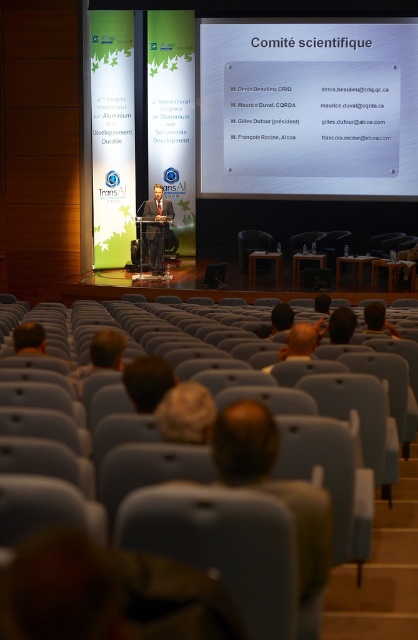
You are an attendee sitting at the back of the auditorium. You notice the white glossy projector screen at upper center and the light brown hair at lower center. How far apart are these two objects from your current position?

The white glossy projector screen at upper center is 43.70 feet away from the light brown hair at lower center, so from your position at the back, the distance between them remains 43.70 feet.

You are a photographer positioned at the camera location. You need to capture a clear image of the white glossy projector screen at upper center. Considering the distance, will you need a telephoto lens to focus on the screen from your current position?

Yes, since the white glossy projector screen at upper center is 17.38 meters away from the camera, a telephoto lens would be necessary to focus on the screen from this distance.

You are attending a formal conference about aluminum and sustainable development in a large auditorium. You notice a speaker at the podium and a point marked at coordinates (x=99, y=356). What is located at that specific point?

The point at coordinates (x=99, y=356) is where the light brown hair at lower center is located.